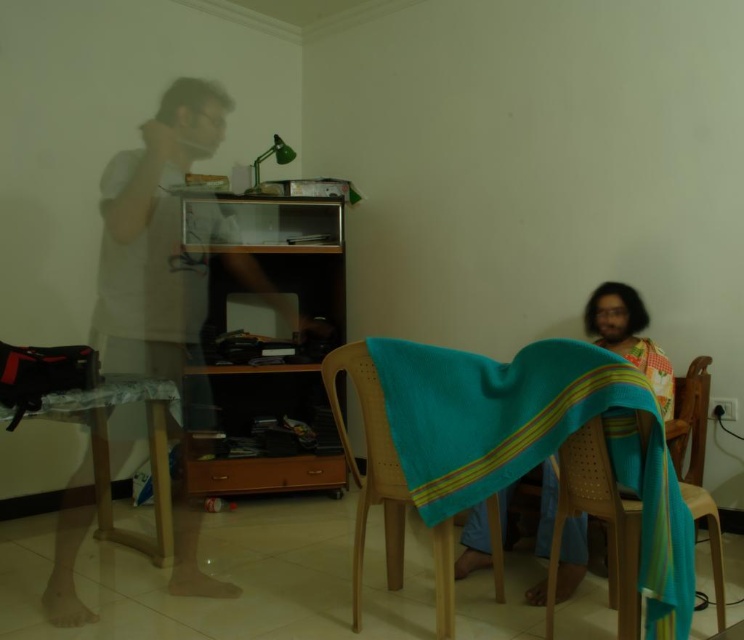
Can you confirm if wooden table at lower left is wider than wooden chair at center?

Yes, wooden table at lower left is wider than wooden chair at center.

Does point (161, 380) come behind point (376, 451)?

That is True.

Image resolution: width=744 pixels, height=640 pixels. I want to click on wooden table at lower left, so 106,484.

Find the location of `wooden table at lower left`. wooden table at lower left is located at coordinates (106, 484).

Who is positioned more to the left, turquoise woven cloth at center or wooden chair at center?

wooden chair at center is more to the left.

Can you confirm if turquoise woven cloth at center is positioned to the right of wooden chair at center?

Yes, turquoise woven cloth at center is to the right of wooden chair at center.

This screenshot has height=640, width=744. Describe the element at coordinates (487, 410) in the screenshot. I see `turquoise woven cloth at center` at that location.

Identify the location of turquoise woven cloth at center. (487, 410).

Who is more distant from viewer, (173, 397) or (711, 577)?

The point (173, 397) is behind.

Does wooden table at lower left have a smaller size compared to wooden chair with woven seat at lower right?

Incorrect, wooden table at lower left is not smaller in size than wooden chair with woven seat at lower right.

I want to click on wooden table at lower left, so click(106, 484).